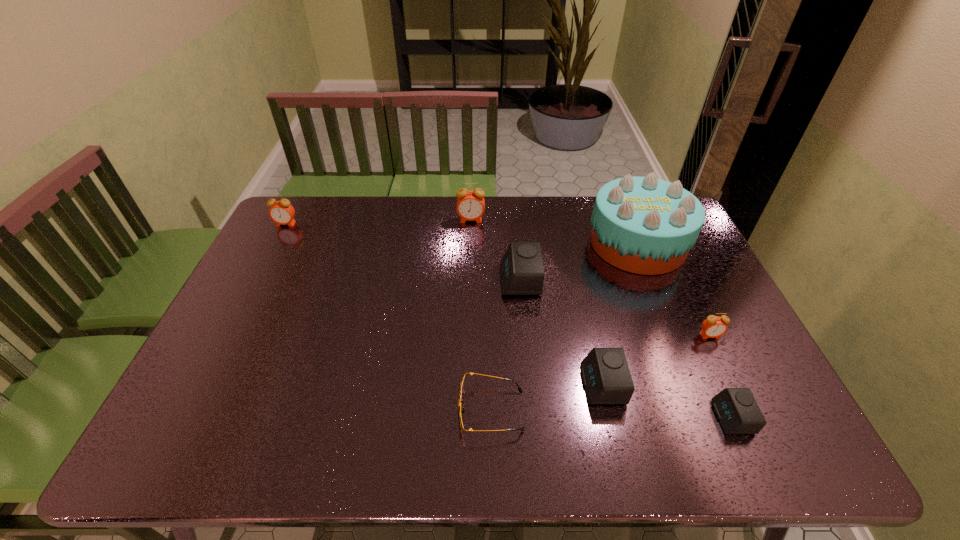
Find the location of `cake that is at the far edge`. cake that is at the far edge is located at coordinates (644, 225).

Locate an element on the screen. Image resolution: width=960 pixels, height=540 pixels. alarm clock that is at the near edge is located at coordinates (737, 410).

I want to click on sunglasses present at the near edge, so click(x=460, y=410).

The image size is (960, 540). I want to click on object present at the left edge, so click(281, 212).

Find the location of a particular element. cake at the right edge is located at coordinates (644, 225).

Where is `object situated at the far left corner`? Image resolution: width=960 pixels, height=540 pixels. object situated at the far left corner is located at coordinates (281, 212).

In order to click on object positioned at the far right corner in this screenshot , I will do `click(644, 225)`.

At what (x,y) coordinates should I click in order to perform the action: click on object that is positioned at the near right corner. Please return your answer as a coordinate pair (x, y). The width and height of the screenshot is (960, 540). Looking at the image, I should click on (737, 410).

Image resolution: width=960 pixels, height=540 pixels. Identify the location of vacant space at the far edge of the desktop. (506, 203).

In the image, there is a desktop. Identify the location of free region at the near edge. This screenshot has height=540, width=960. (624, 457).